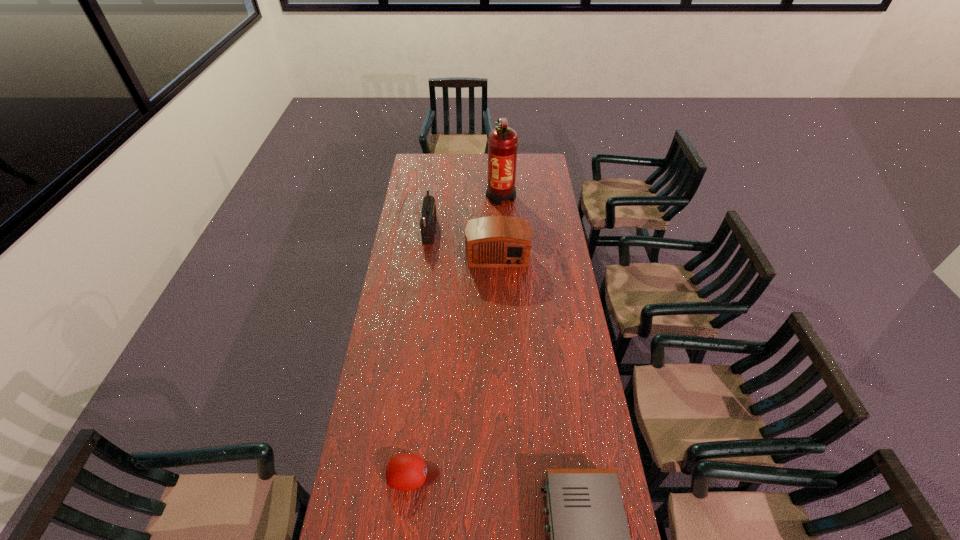
You are a GUI agent. You are given a task and a screenshot of the screen. Output one action in this format:
    pyautogui.click(x=<x>, y=<y>)
    Task: Click on the vacant area between the shortest object and the tallest object
    The width and height of the screenshot is (960, 540).
    Given the screenshot: What is the action you would take?
    pyautogui.click(x=457, y=334)

The width and height of the screenshot is (960, 540). Find the location of `free space between the second tallest object and the farthest object`. free space between the second tallest object and the farthest object is located at coordinates (466, 212).

Find the location of a particular element. The height and width of the screenshot is (540, 960). object that is the nearest to the second tallest radio receiver is located at coordinates (428, 211).

Select which object is the third closest to the baseball cap. Please provide its 2D coordinates. Your answer should be formatted as a tuple, i.e. [(x, y)], where the tuple contains the x and y coordinates of a point satisfying the conditions above.

[(428, 211)]

Locate an element on the screen. radio receiver that is the closest to the third tallest object is located at coordinates (428, 211).

Where is `radio receiver identified as the second closest to the tallest object`? radio receiver identified as the second closest to the tallest object is located at coordinates (428, 211).

This screenshot has height=540, width=960. I want to click on vacant position in the image that satisfies the following two spatial constraints: 1. on the front-facing side of the farthest object; 2. on the front-facing side of the shortest object, so click(x=516, y=474).

Where is `free region that satisfies the following two spatial constraints: 1. on the front-facing side of the tallest object; 2. on the front-facing side of the baseball cap`? This screenshot has height=540, width=960. free region that satisfies the following two spatial constraints: 1. on the front-facing side of the tallest object; 2. on the front-facing side of the baseball cap is located at coordinates (516, 474).